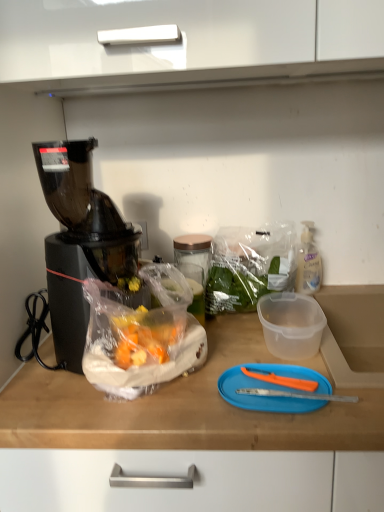
Identify the location of translucent plastic bag at center. (249, 266).

This screenshot has width=384, height=512. Describe the element at coordinates (249, 266) in the screenshot. I see `translucent plastic bag at center` at that location.

What do you see at coordinates (271, 388) in the screenshot?
I see `blue plastic cutting board at center` at bounding box center [271, 388].

What is the approximate height of clear plastic bottle at right?

clear plastic bottle at right is 7.69 inches tall.

Identify the location of black plastic blender at left. (80, 241).

Which of these two, black plastic blender at left or translucent plastic bag at center, stands shorter?

Standing shorter between the two is translucent plastic bag at center.

Which is more to the right, black plastic blender at left or translucent plastic bag at center?

translucent plastic bag at center.

How many degrees apart are the facing directions of black plastic blender at left and translucent plastic bag at center?

→ The facing directions of black plastic blender at left and translucent plastic bag at center are 0.181 degrees apart.

Does translucent plastic bag at center appear on the left side of black plastic blender at left?

Incorrect, translucent plastic bag at center is not on the left side of black plastic blender at left.

Looking at this image, considering the relative sizes of translucent plastic bag at center and black plastic blender at left in the image provided, is translucent plastic bag at center taller than black plastic blender at left?

→ Incorrect, the height of translucent plastic bag at center is not larger of that of black plastic blender at left.

From a real-world perspective, is translucent plastic bag at center above or below black plastic blender at left?

translucent plastic bag at center is situated lower than black plastic blender at left in the real world.

The width and height of the screenshot is (384, 512). In order to click on plastic bag below the black plastic blender at left (from the image's perspective) in this screenshot , I will do `click(249, 266)`.

Based on the photo, does clear plastic bottle at right have a greater width compared to translucent plastic bag at center?

In fact, clear plastic bottle at right might be narrower than translucent plastic bag at center.

Can you tell me how much clear plastic bottle at right and translucent plastic bag at center differ in facing direction?

0.447 degrees.

Would you say clear plastic bottle at right is a long distance from translucent plastic bag at center?

No, clear plastic bottle at right is not far away from translucent plastic bag at center.

Consider the image. From the image's perspective, is clear plastic bottle at right below translucent plastic bag at center?

No, from the image's perspective, clear plastic bottle at right is not below translucent plastic bag at center.

Between blue plastic cutting board at center and black plastic blender at left, which one appears on the left side from the viewer's perspective?

Positioned to the left is black plastic blender at left.

Identify the location of blender on the left of blue plastic cutting board at center. point(80,241).

In the scene shown: Is blue plastic cutting board at center not inside black plastic blender at left?

Yes, blue plastic cutting board at center is located beyond the bounds of black plastic blender at left.

Which is behind, point (262, 373) or point (75, 340)?

The point (75, 340) is behind.

Considering the points (262, 238) and (297, 276), which point is behind, point (262, 238) or point (297, 276)?

The point (297, 276) is farther.

Are translucent plastic bag at center and clear plastic bottle at right beside each other?

No, translucent plastic bag at center is not making contact with clear plastic bottle at right.

From the image's perspective, which object appears higher, translucent plastic bag at center or clear plastic bottle at right?

From the image's view, clear plastic bottle at right is above.

From a real-world perspective, is translucent plastic bag at center physically below clear plastic bottle at right?

Incorrect, from a real-world perspective, translucent plastic bag at center is higher than clear plastic bottle at right.

Is clear plastic bottle at right in front of or behind black plastic blender at left in the image?

clear plastic bottle at right is positioned farther from the viewer than black plastic blender at left.

Locate an element on the screen. The height and width of the screenshot is (512, 384). bottle that is under the black plastic blender at left (from a real-world perspective) is located at coordinates (308, 261).

Can you tell me how much clear plastic bottle at right and black plastic blender at left differ in facing direction?

The angular difference between clear plastic bottle at right and black plastic blender at left is 0.628 degrees.

Can you confirm if clear plastic bottle at right is smaller than blue plastic cutting board at center?

No, clear plastic bottle at right is not smaller than blue plastic cutting board at center.

In the scene shown: In the image, is clear plastic bottle at right positioned in front of or behind blue plastic cutting board at center?

Clearly, clear plastic bottle at right is behind blue plastic cutting board at center.

Find the location of a particular element. bottle behind the blue plastic cutting board at center is located at coordinates (308, 261).

I want to click on plastic bag below the black plastic blender at left (from the image's perspective), so click(249, 266).

Find the location of a particular element. Image resolution: width=384 pixels, height=512 pixels. blender above the translucent plastic bag at center (from a real-world perspective) is located at coordinates (80, 241).

From the image, which object appears to be farther from translucent plastic bag at center, clear plastic bottle at right or blue plastic cutting board at center?

The object further to translucent plastic bag at center is blue plastic cutting board at center.

When comparing their distances from blue plastic cutting board at center, does clear plastic bottle at right or translucent plastic bag at center seem further?

clear plastic bottle at right is positioned further to the anchor blue plastic cutting board at center.

Considering their positions, is translucent plastic bag at center positioned closer to blue plastic cutting board at center than clear plastic bottle at right?

Based on the image, translucent plastic bag at center appears to be nearer to blue plastic cutting board at center.

From the image, which object appears to be nearer to blue plastic cutting board at center, black plastic blender at left or translucent plastic bag at center?

The object closer to blue plastic cutting board at center is translucent plastic bag at center.

Looking at this image, looking at the image, which one is located closer to translucent plastic bag at center, blue plastic cutting board at center or black plastic blender at left?

blue plastic cutting board at center lies closer to translucent plastic bag at center than the other object.

Estimate the real-world distances between objects in this image. Which object is closer to black plastic blender at left, clear plastic bottle at right or translucent plastic bag at center?

The object closer to black plastic blender at left is translucent plastic bag at center.

Based on their spatial positions, is clear plastic bottle at right or blue plastic cutting board at center closer to black plastic blender at left?

blue plastic cutting board at center.

Looking at the image, which one is located further to clear plastic bottle at right, black plastic blender at left or translucent plastic bag at center?

Based on the image, black plastic blender at left appears to be further to clear plastic bottle at right.

Where is `plastic bag between black plastic blender at left and blue plastic cutting board at center in the horizontal direction`? plastic bag between black plastic blender at left and blue plastic cutting board at center in the horizontal direction is located at coordinates (249, 266).

The image size is (384, 512). I want to click on cutting board between black plastic blender at left and clear plastic bottle at right from left to right, so click(271, 388).

Find the location of `plastic bag positioned between blue plastic cutting board at center and clear plastic bottle at right from near to far`. plastic bag positioned between blue plastic cutting board at center and clear plastic bottle at right from near to far is located at coordinates (249, 266).

Where is `plastic bag located between black plastic blender at left and clear plastic bottle at right in the left-right direction`? The height and width of the screenshot is (512, 384). plastic bag located between black plastic blender at left and clear plastic bottle at right in the left-right direction is located at coordinates (249, 266).